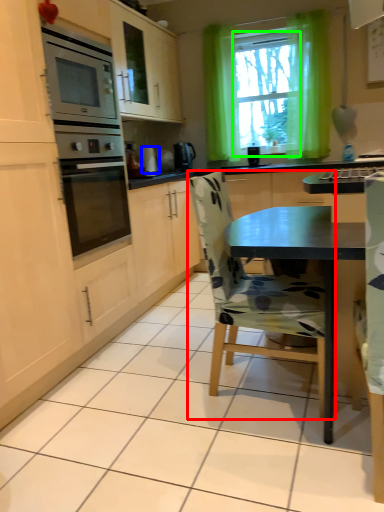
Question: Which object is positioned farthest from chair (highlighted by a red box)? Select from appliance (highlighted by a blue box) and window screen (highlighted by a green box).

Choices:
 (A) appliance
 (B) window screen

Answer: (B)